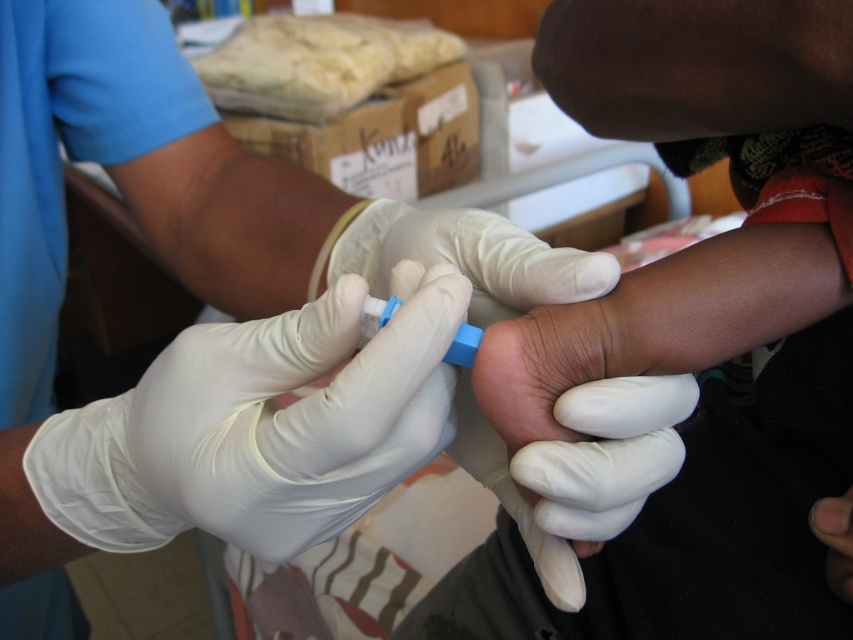
You are a medical student observing a blood draw procedure. You notice two objects labeled as white latex gloves at center and white latex glove at center. Which one is positioned higher?

The white latex gloves at center is positioned higher than the white latex glove at center.

You are a medical student observing a blood draw procedure. The point marked at coordinates (300, 433) is where the lancet will be applied. If your eyes are 5 feet away from the point, is the distance sufficient to safely observe without obstructing the procedure?

The distance between the point (300, 433) and the viewer is 12.19 inches. Since 5 feet equals 60 inches, which is much greater than 12.19 inches, the distance is sufficient for safe observation without obstruction.